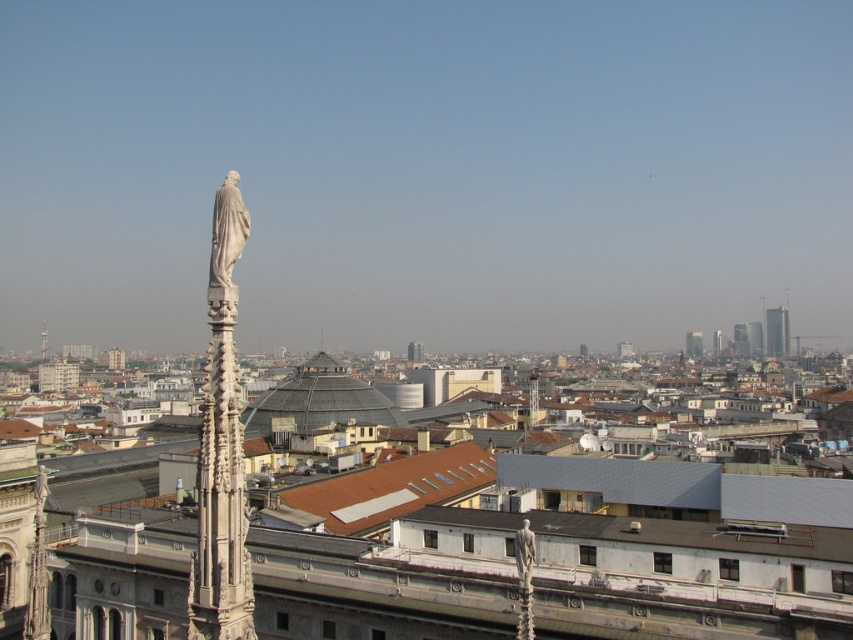
You are an architect analyzing this cityscape. You notice the white marble statue at left and the smooth glass skyscraper at right. Which object is located to the east if the city is oriented with the spire facing north?

The smooth glass skyscraper at right is located to the east because the city is oriented with the spire facing north, and the statue is on the left side of the skyscraper, meaning the statue is to the north and the skyscraper is to the east.

You are an architect designing a new sculpture garden. You want to place the white marble statue at left and the matte white tower at center in your design. Which object should be placed closer to the entrance to ensure it doesn

The white marble statue at left has a smaller width than the matte white tower at center, so placing it closer to the entrance will allow visitors to see the larger tower from a distance while the smaller statue can be viewed up close.